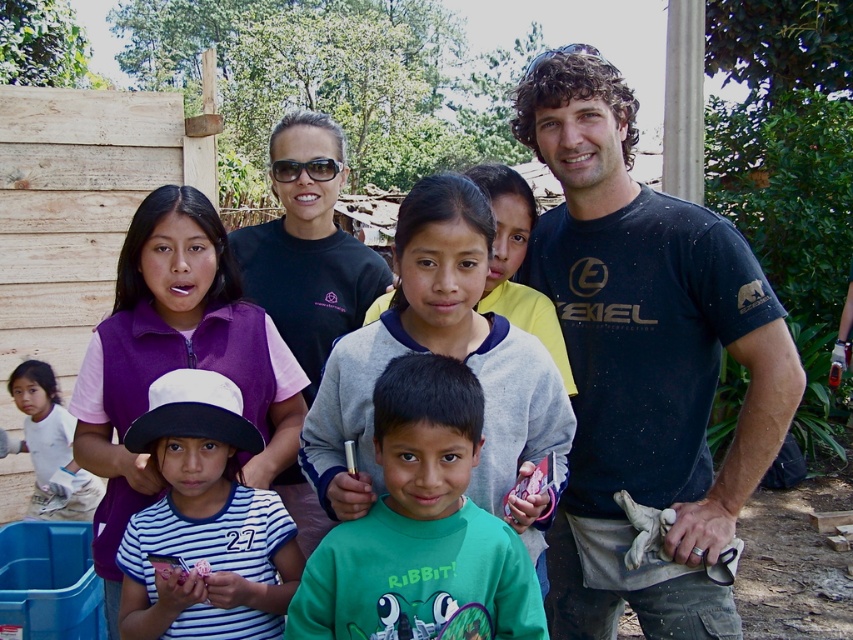
Question: Which object is closer to the camera taking this photo?

Choices:
 (A) green matte shirt at center
 (B) black cotton t-shirt at right
 (C) white striped shirt at center

Answer: (A)

Question: Which object is farther from the camera taking this photo?

Choices:
 (A) black cotton t-shirt at right
 (B) white matte glove at lower left
 (C) matte black shirt at upper center
 (D) purple fleece vest at upper left

Answer: (B)

Question: Which object appears closest to the camera in this image?

Choices:
 (A) black cotton t-shirt at right
 (B) green matte shirt at center

Answer: (B)

Question: Is black cotton t-shirt at right bigger than green matte shirt at center?

Choices:
 (A) no
 (B) yes

Answer: (B)

Question: In this image, where is gray fleece sweater at center located relative to green matte shirt at center?

Choices:
 (A) left
 (B) right

Answer: (B)

Question: Is black cotton t-shirt at right to the left of gray fleece sweater at center from the viewer's perspective?

Choices:
 (A) yes
 (B) no

Answer: (B)